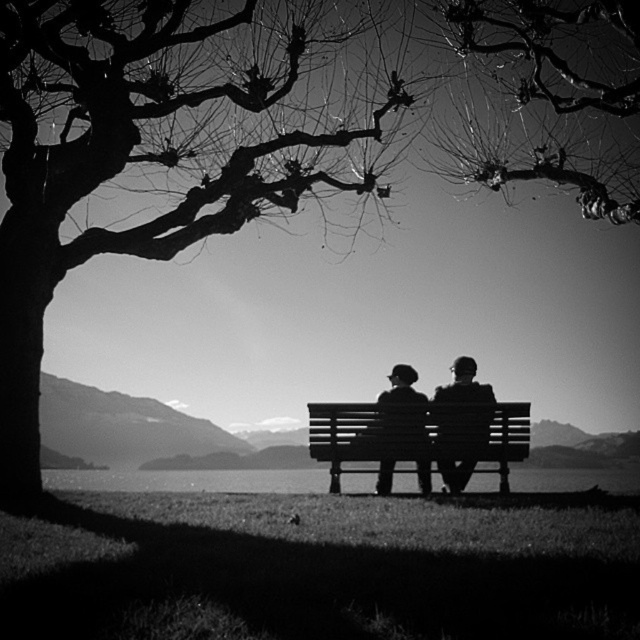
How much distance is there between smooth bark tree at upper center and smooth wooden bench at center?

A distance of 3.86 meters exists between smooth bark tree at upper center and smooth wooden bench at center.

Between point (502, 177) and point (410, 376), which one is positioned behind?

Positioned behind is point (410, 376).

The height and width of the screenshot is (640, 640). In order to click on smooth bark tree at upper center in this screenshot , I will do `click(541, 97)`.

Between silhouette bark tree at left and smooth wooden bench at center, which one has more height?

With more height is smooth wooden bench at center.

Can you confirm if silhouette bark tree at left is positioned to the right of smooth wooden bench at center?

No, silhouette bark tree at left is not to the right of smooth wooden bench at center.

Which is in front, point (262, 40) or point (408, 397)?

Point (408, 397) is in front.

The width and height of the screenshot is (640, 640). In order to click on silhouette bark tree at left in this screenshot , I will do `click(163, 141)`.

Can you confirm if silhouette wooden bench at center is smaller than smooth black jacket at center?

No, silhouette wooden bench at center is not smaller than smooth black jacket at center.

Does silhouette wooden bench at center appear under smooth black jacket at center?

Actually, silhouette wooden bench at center is above smooth black jacket at center.

Locate an element on the screen. This screenshot has height=640, width=640. silhouette wooden bench at center is located at coordinates (465, 385).

Locate an element on the screen. Image resolution: width=640 pixels, height=640 pixels. silhouette wooden bench at center is located at coordinates (465, 385).